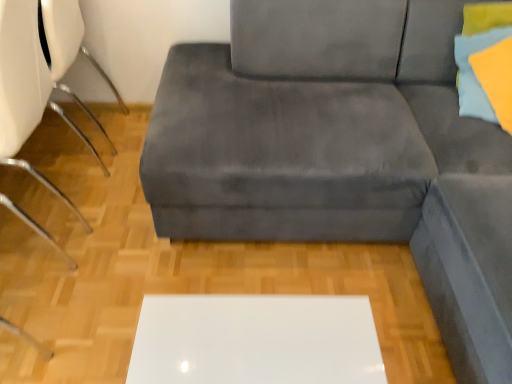
Where is `free space above white glossy table at center (from a real-world perspective)`? free space above white glossy table at center (from a real-world perspective) is located at coordinates (248, 337).